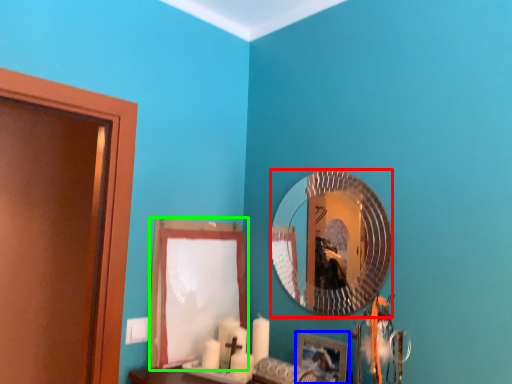
Question: Based on their relative distances, which object is nearer to mirror (highlighted by a red box)? Choose from picture frame (highlighted by a blue box) and curtain (highlighted by a green box).

Choices:
 (A) picture frame
 (B) curtain

Answer: (A)